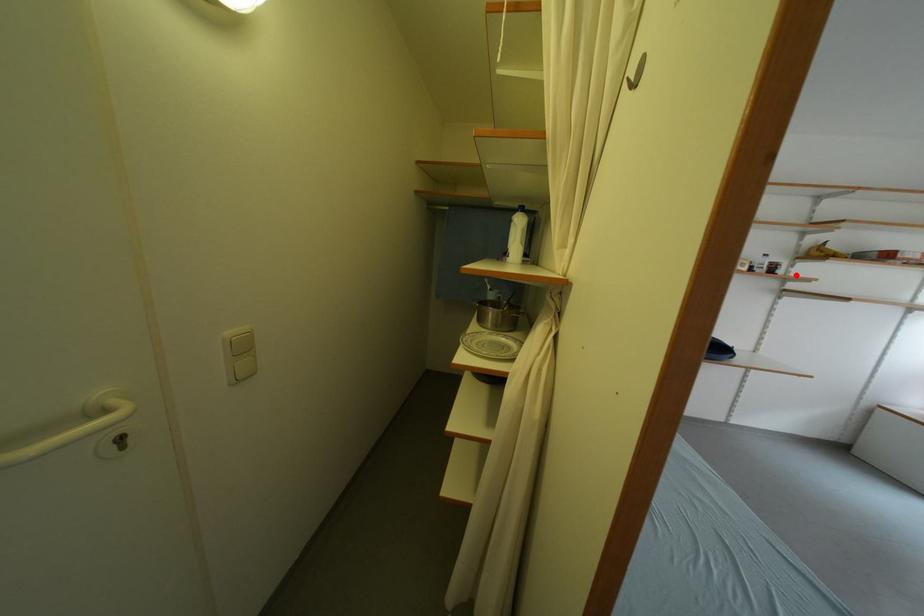
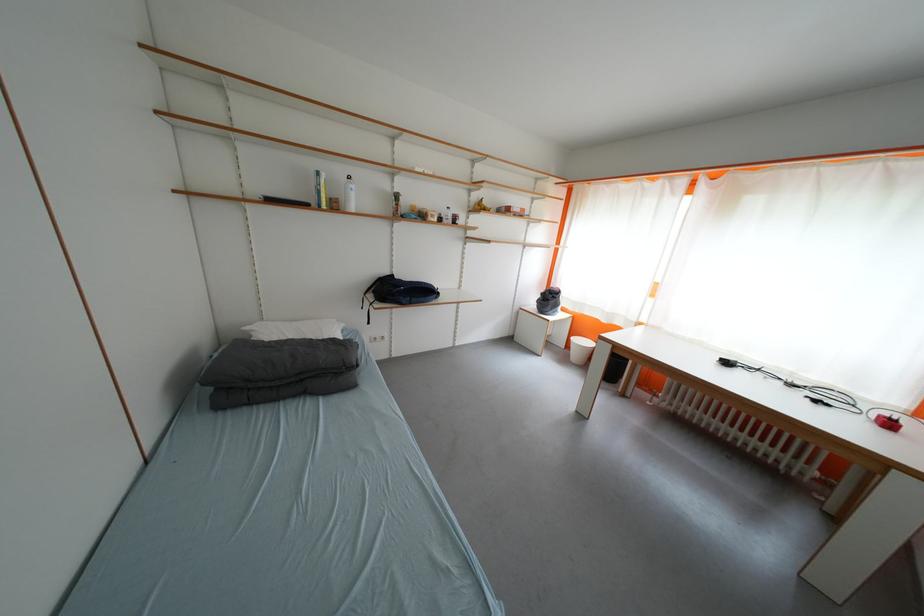
Question: I am providing you with two images of the same scene from different viewpoints. A red point is marked on the first image. At the location where the point appears in image 1, is it still visible in image 2?

Choices:
 (A) Yes
 (B) No

Answer: (A)